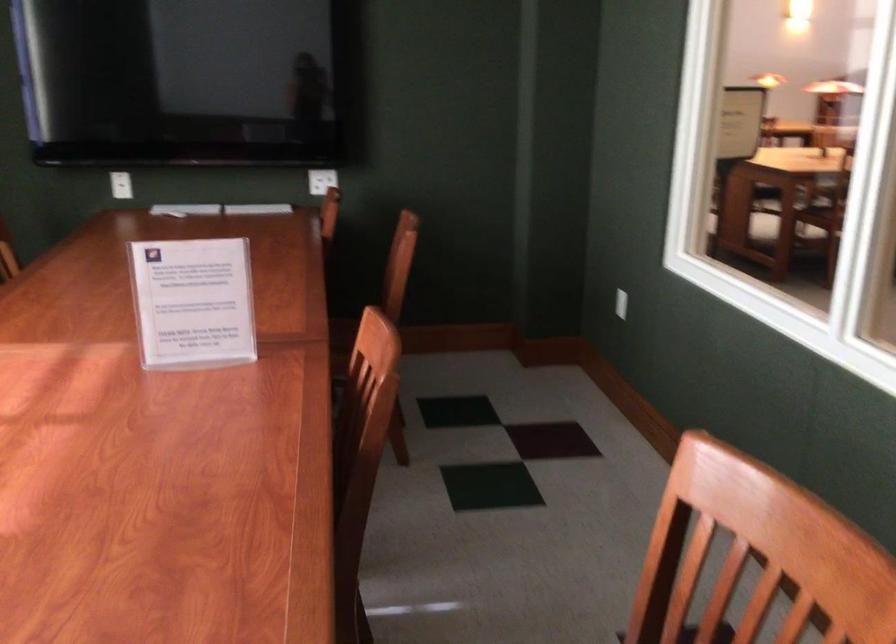
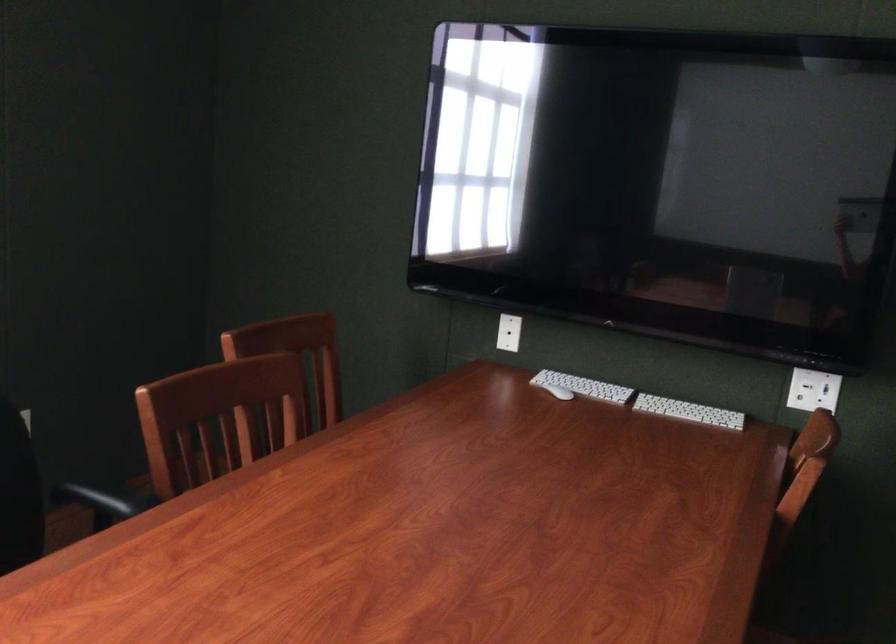
Find the pixel in the second image that matches the point at 179,210 in the first image.

(558, 392)